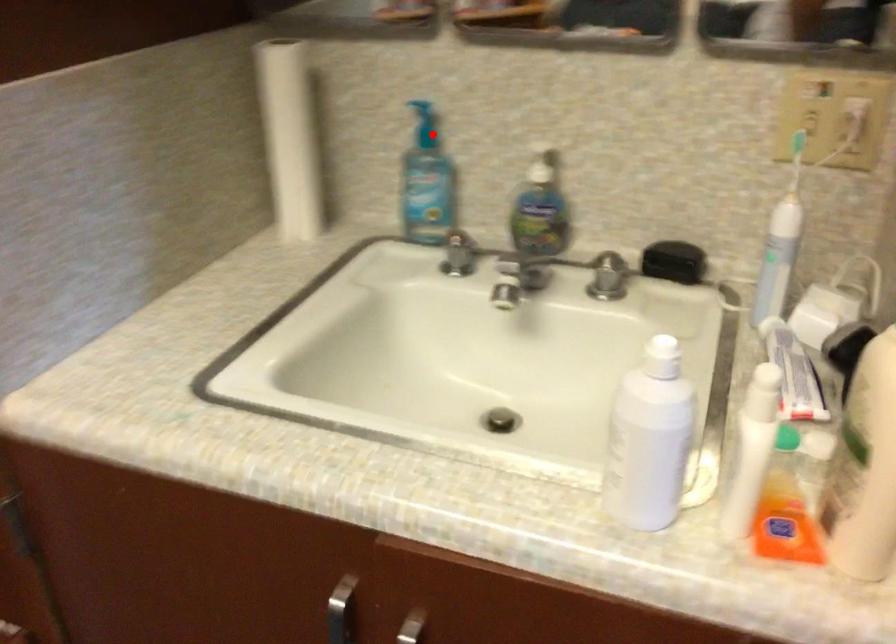
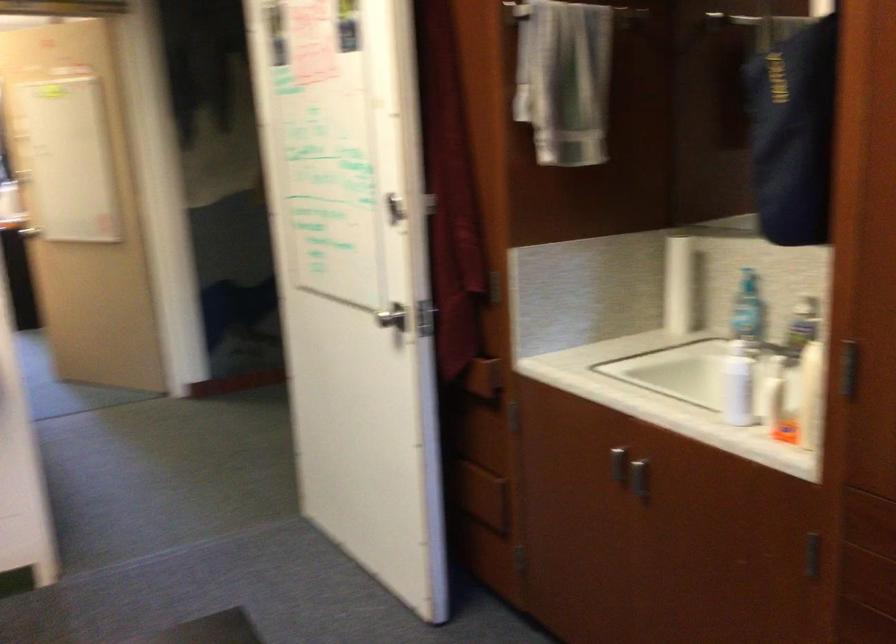
In the second image, find the point that corresponds to the highlighted location in the first image.

(747, 279)